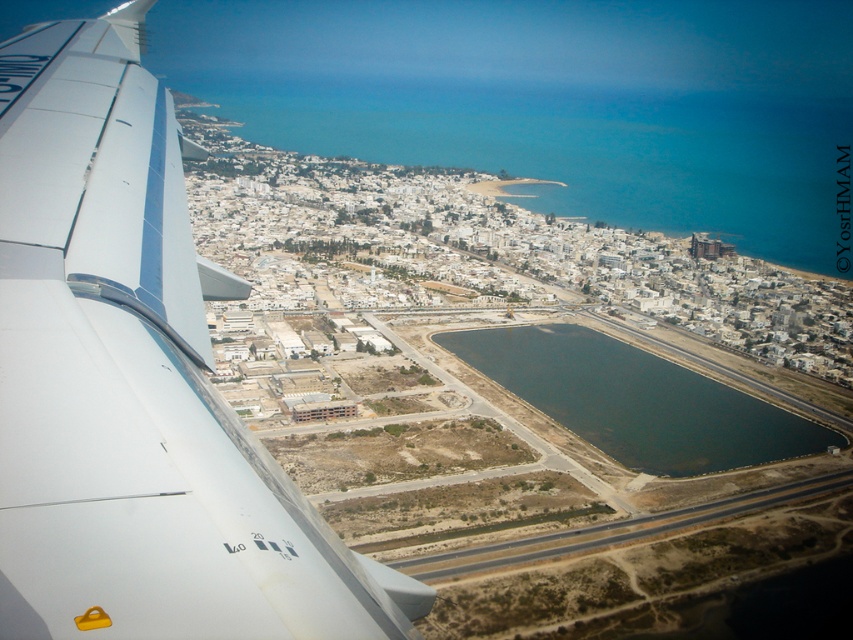
You are a passenger seated at the window seat of the airplane. You notice the white matte airplane wing at upper left and the dark blue water at center. Which object occupies more horizontal space in your view?

The white matte airplane wing at upper left occupies more horizontal space than the dark blue water at center because its width surpasses the water.

Consider the image. You are a passenger looking out the airplane window. You notice the white matte airplane wing at upper left and the dark blue water at center. Which object appears larger in height when viewed from your seat?

The white matte airplane wing at upper left appears much taller than the dark blue water at center because it is closer to you, making it look larger in height.

You are a passenger sitting by the window and looking out. You see the white matte airplane wing at upper left and the dark blue water at center. Which object is closer to the left side of your view?

The white matte airplane wing at upper left is closer to the left side of your view because it is positioned to the left of the dark blue water at center.